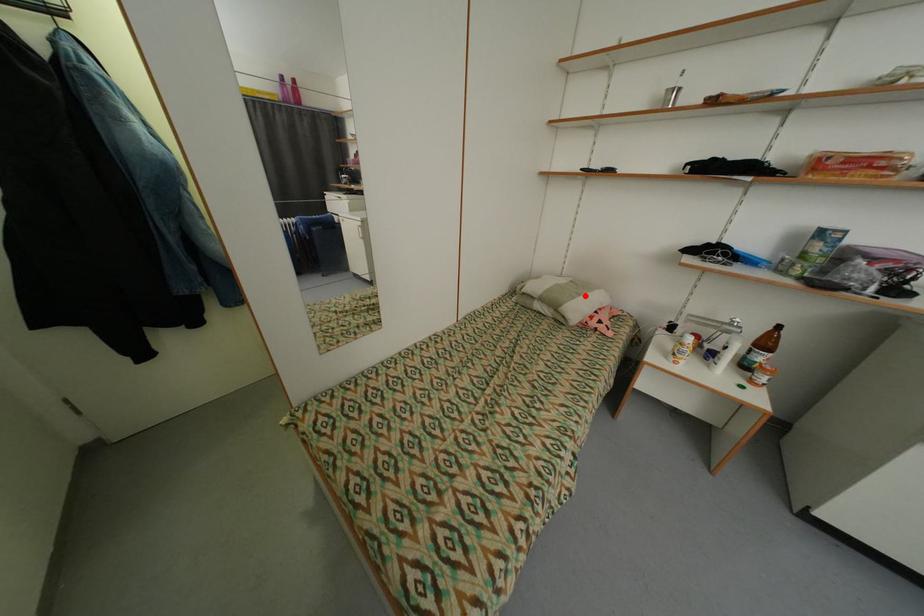
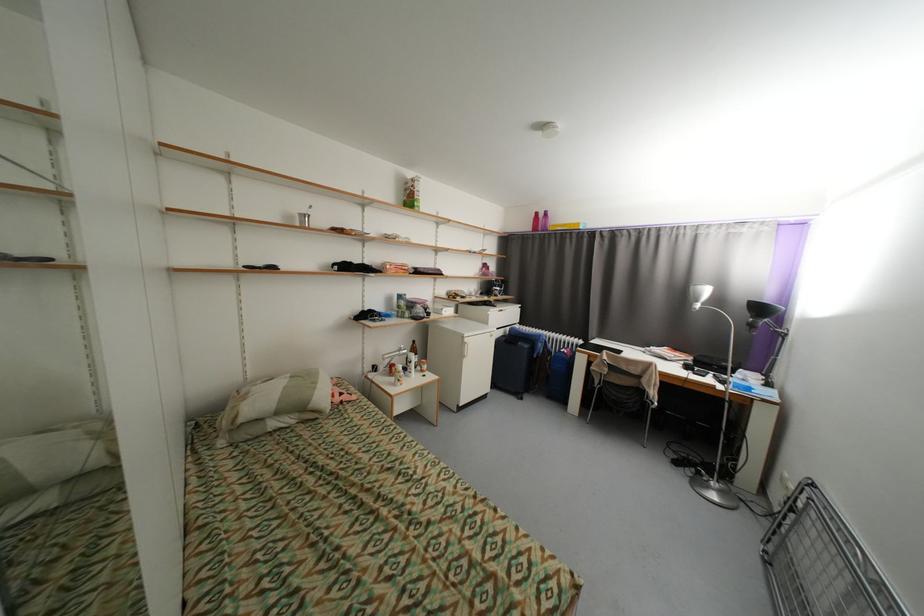
Question: I am providing you with two images of the same scene from different viewpoints. In image1, a red point is highlighted. Considering the same 3D point in image2, which of the following is correct?

Choices:
 (A) It is closer
 (B) It is farther

Answer: (A)